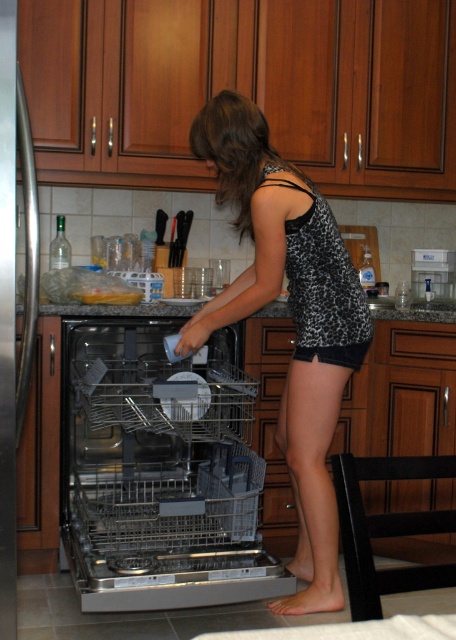
Does metallic gray dishwasher at center have a smaller size compared to black leopard print tank top at center?

No.

Find the location of `metallic gray dishwasher at center`. metallic gray dishwasher at center is located at coordinates (160, 474).